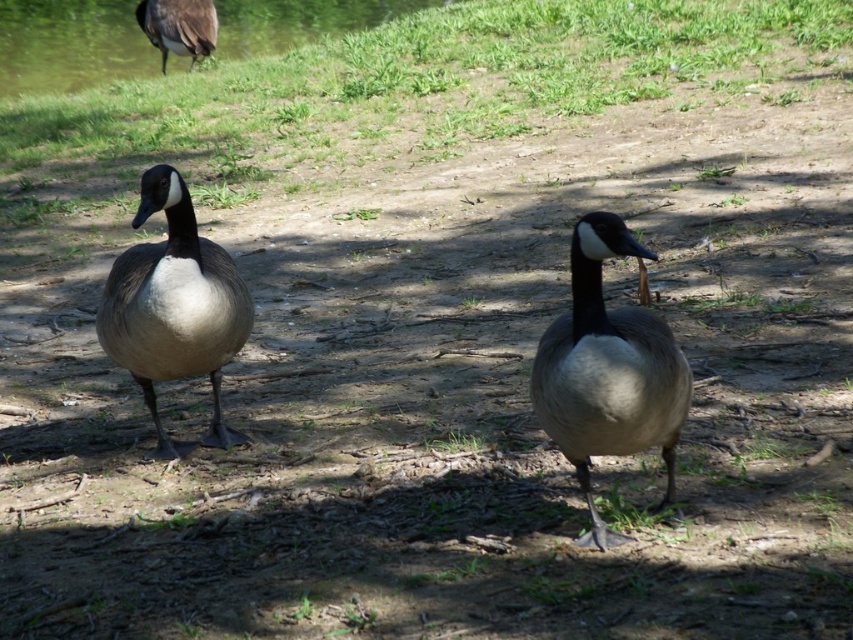
Question: Which of the following is the farthest from the observer?

Choices:
 (A) dark gray feathers at upper left
 (B) green grass at upper left

Answer: (B)

Question: Can you confirm if green grass at upper center is bigger than dark gray feathers at upper left?

Choices:
 (A) yes
 (B) no

Answer: (B)

Question: Among these points, which one is farthest from the camera?

Choices:
 (A) (137, 260)
 (B) (589, 72)

Answer: (B)

Question: Among these objects, which one is farthest from the camera?

Choices:
 (A) matte gray goose at center
 (B) green grass at upper left
 (C) gray matte goose at left
 (D) dark gray feathers at upper left

Answer: (B)

Question: Is the position of green grass at upper center less distant than that of dark gray feathers at upper left?

Choices:
 (A) no
 (B) yes

Answer: (B)

Question: Can you confirm if matte gray goose at center is positioned below dark gray feathers at upper left?

Choices:
 (A) yes
 (B) no

Answer: (A)